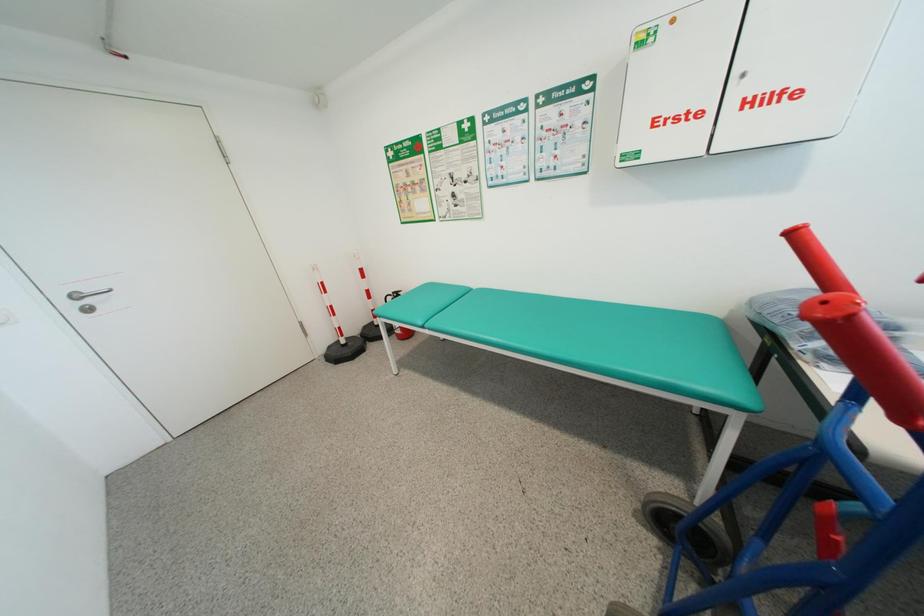
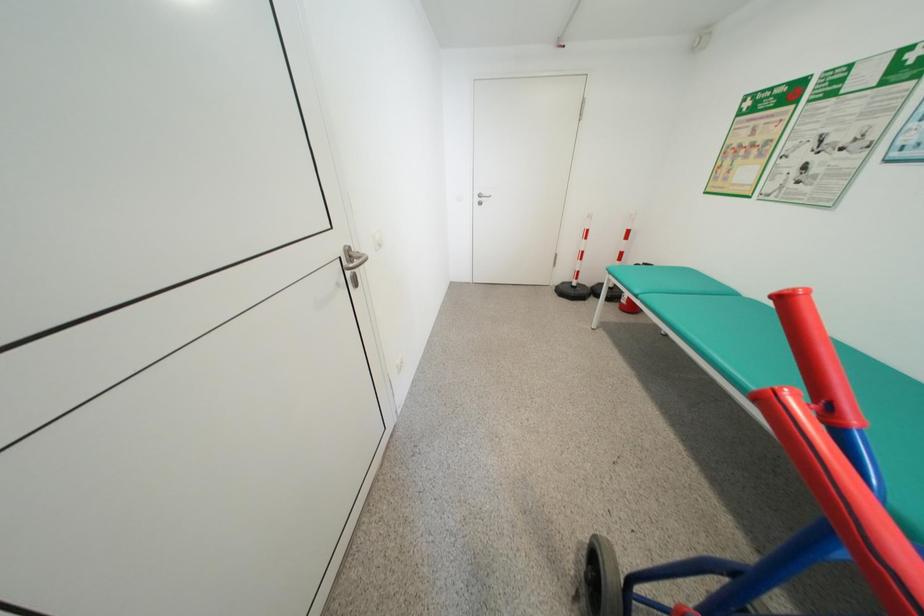
The first image is from the beginning of the video and the second image is from the end. How did the camera likely rotate when shooting the video?

The rotation direction of the camera is left-down.